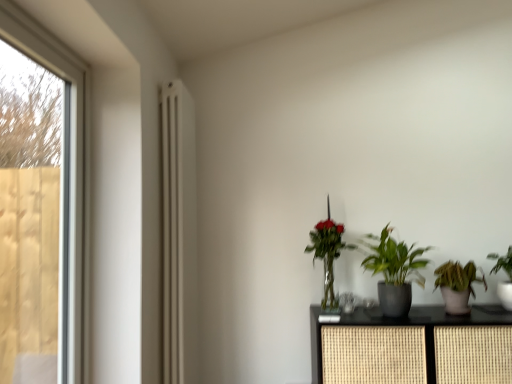
This screenshot has width=512, height=384. In order to click on free spot above transparent glass screen door at left (from a real-world perspective) in this screenshot , I will do `click(50, 36)`.